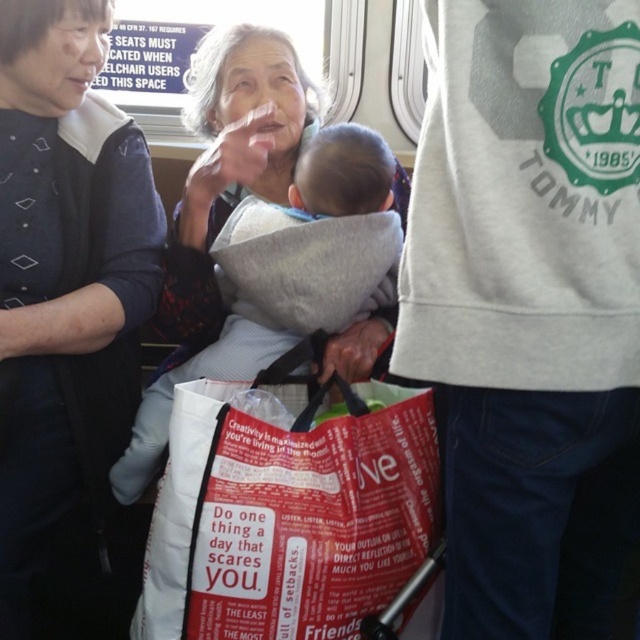
Question: Among these points, which one is farthest from the camera?

Choices:
 (A) (486, 490)
 (B) (92, 12)

Answer: (B)

Question: Is white cotton sweatshirt at center to the left of soft gray fabric baby carrier at center from the viewer's perspective?

Choices:
 (A) yes
 (B) no

Answer: (B)

Question: Observing the image, what is the correct spatial positioning of white cotton sweatshirt at center in reference to red fabric bag at center?

Choices:
 (A) above
 (B) below

Answer: (A)

Question: Which object is closer to the camera taking this photo?

Choices:
 (A) soft gray fabric baby carrier at center
 (B) white cotton sweatshirt at center
 (C) gray fabric baby carrier at center

Answer: (B)

Question: Does red fabric bag at center come behind soft gray fabric baby carrier at center?

Choices:
 (A) yes
 (B) no

Answer: (B)

Question: Which object is the farthest from the red fabric bag at center?

Choices:
 (A) white cotton sweatshirt at center
 (B) soft gray fabric baby carrier at center
 (C) gray fabric baby carrier at center

Answer: (C)